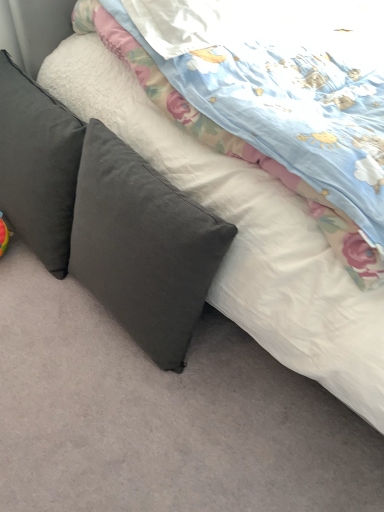
Identify the location of vacant area that lies in front of dark gray fabric pillow at left, the 2th pillow viewed from the left. (116, 417).